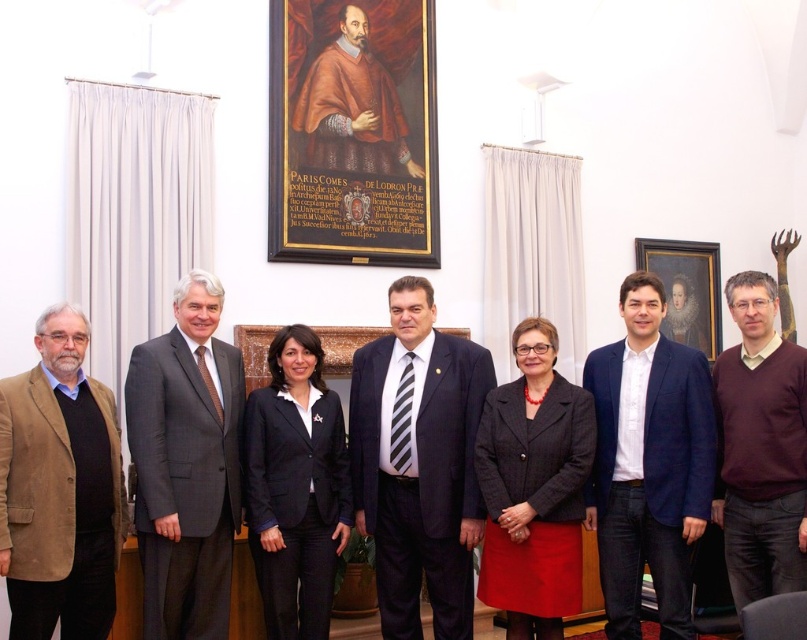
You are a photographer adjusting your camera settings to capture a group photo. The wooden framed portrait at upper center is part of the background. If the camera is focused at 6 meters, will the portrait be in focus?

The wooden framed portrait at upper center is 6.24 meters from the camera. Since the focus is set at 6 meters, the portrait will be slightly out of focus as it is 0.24 meters beyond the focused distance.

Based on the scene description and the objects provided, what does the point at coordinates (352, 132) represent?

The point at coordinates (352, 132) indicates the location of the wooden framed portrait at upper center.

You are an interior designer assessing the wall space in this professional setting. You notice the wooden framed portrait at upper center and the wooden picture frame at center. Which of these two items is taller?

The wooden framed portrait at upper center is taller than the wooden picture frame at center.